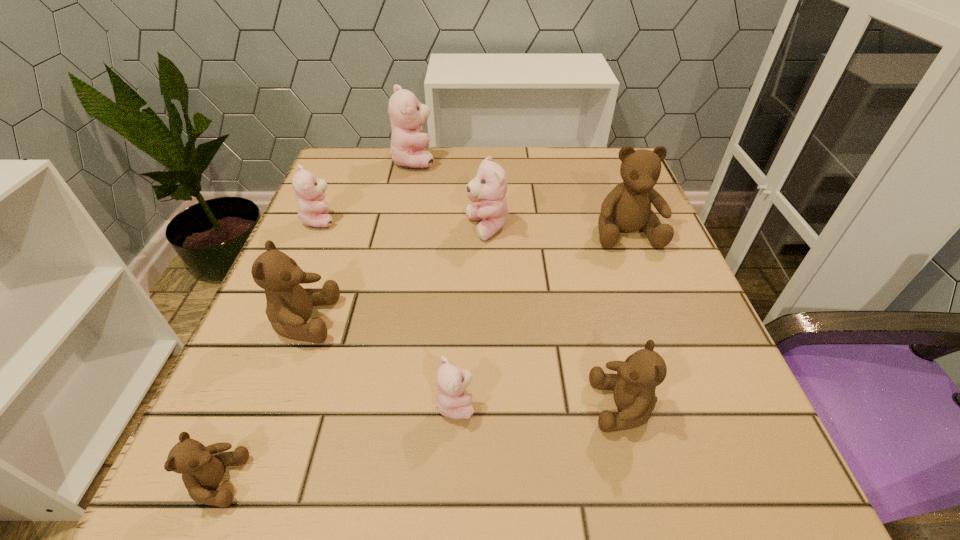
I want to click on brown teddy bear that is the fourth closest to the second biggest pink teddy bear, so click(x=202, y=468).

Where is `vacant area that satisfies the following two spatial constraints: 1. on the front-facing side of the biggest brown teddy bear; 2. at the face of the smallest pink teddy bear`? This screenshot has width=960, height=540. vacant area that satisfies the following two spatial constraints: 1. on the front-facing side of the biggest brown teddy bear; 2. at the face of the smallest pink teddy bear is located at coordinates (692, 404).